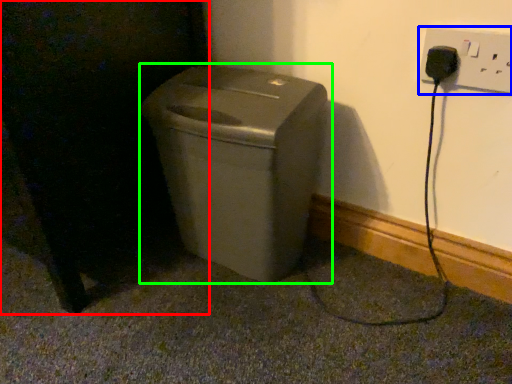
Question: Which is nearer to the dark (highlighted by a red box)? electric outlet (highlighted by a blue box) or waste container (highlighted by a green box).

Choices:
 (A) electric outlet
 (B) waste container

Answer: (B)